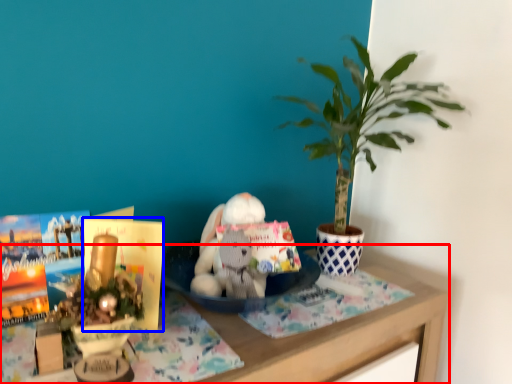
Question: Among these objects, which one is farthest to the camera, table (highlighted by a red box) or paperback book (highlighted by a blue box)?

Choices:
 (A) table
 (B) paperback book

Answer: (B)